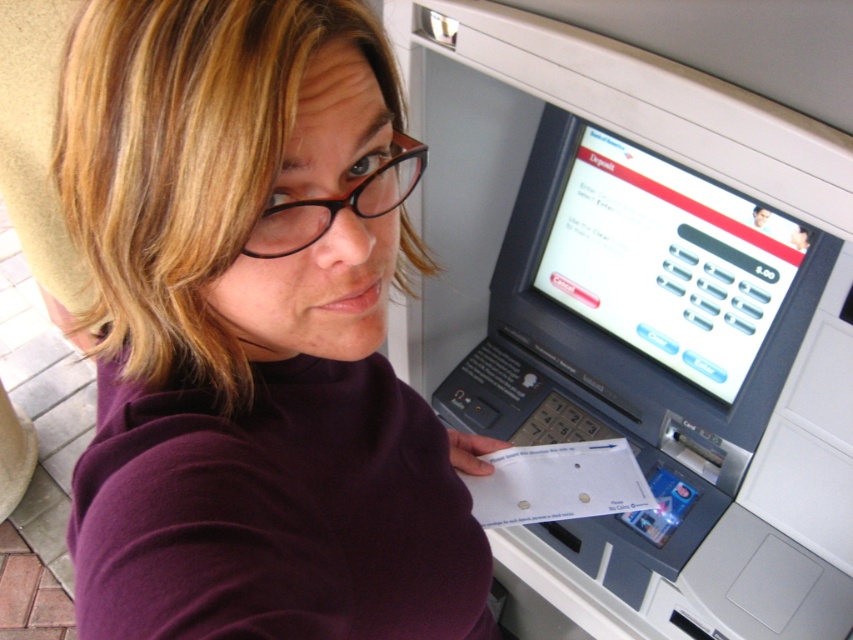
Which is more to the left, purple turtleneck sweater at center or black plastic glasses at upper center?

purple turtleneck sweater at center

Between point (445, 472) and point (387, 200), which one is positioned in front?

Positioned in front is point (387, 200).

Locate an element on the screen. This screenshot has width=853, height=640. purple turtleneck sweater at center is located at coordinates (254, 333).